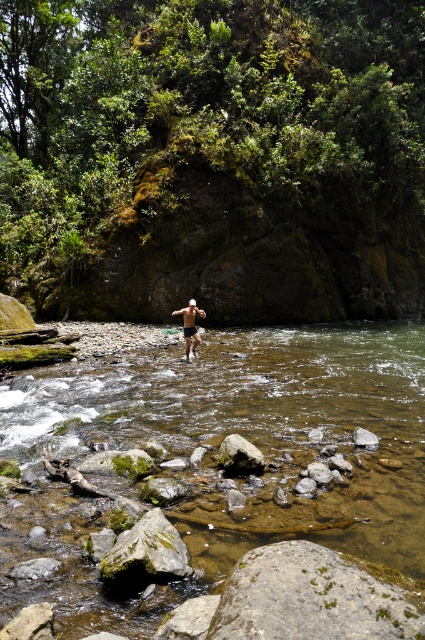
Question: In this image, where is green mossy rock at center located relative to white cotton shorts at center?

Choices:
 (A) above
 (B) below

Answer: (B)

Question: Is smooth gray rock at center thinner than shiny silver shorts at center?

Choices:
 (A) no
 (B) yes

Answer: (B)

Question: Is clear water at stream center bigger than smooth gray rock at center?

Choices:
 (A) no
 (B) yes

Answer: (B)

Question: Estimate the real-world distances between objects in this image. Which object is closer to the white cotton shorts at center?

Choices:
 (A) smooth gray rock at center
 (B) gray smooth rock at lower center
 (C) mossy gray rock at lower center
 (D) green mossy rock at center

Answer: (B)

Question: Which point appears closest to the camera in this image?

Choices:
 (A) (184, 308)
 (B) (184, 332)

Answer: (B)

Question: Which point appears farthest from the camera in this image?

Choices:
 (A) (135, 400)
 (B) (195, 337)

Answer: (B)